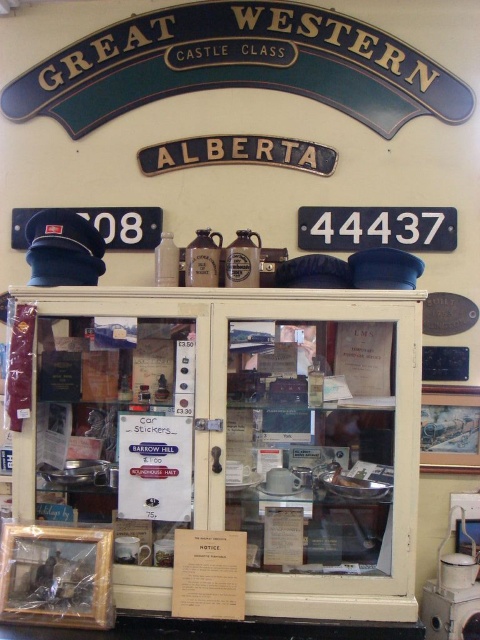
Based on the photo, you are a visitor looking at the display cabinet with the vintage railway theme. You see a white paper at center and a white paper notice at center. Which one is positioned to the left?

The white paper at center is to the left of the white paper notice at center.

You are a visitor at the vintage railway display and notice two white papers in the center of the cabinet. The first is labeled as white paper at center, and the second is white paper notice at center. Which one is wider?

The white paper at center is wider than the white paper notice at center.

You are a visitor at the museum and see the display cabinet with the vintage railway theme. You notice two white paper items inside the cabinet. One is labeled as the white paper at center and the other as the white paper notice at center. From your perspective outside the cabinet, which of these two items is positioned higher up?

The white paper at center is positioned higher up because it is located above the white paper notice at center inside the display cabinet.